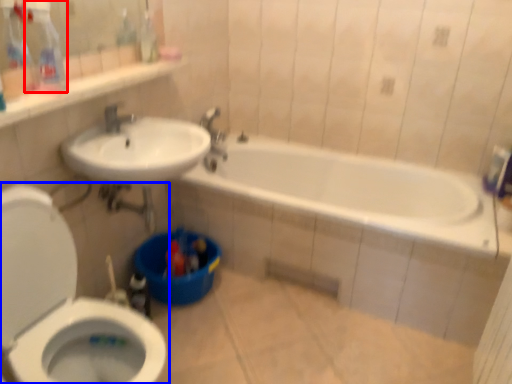
Question: Which point is further to the camera, cleaning product (highlighted by a red box) or toilet (highlighted by a blue box)?

Choices:
 (A) cleaning product
 (B) toilet

Answer: (A)